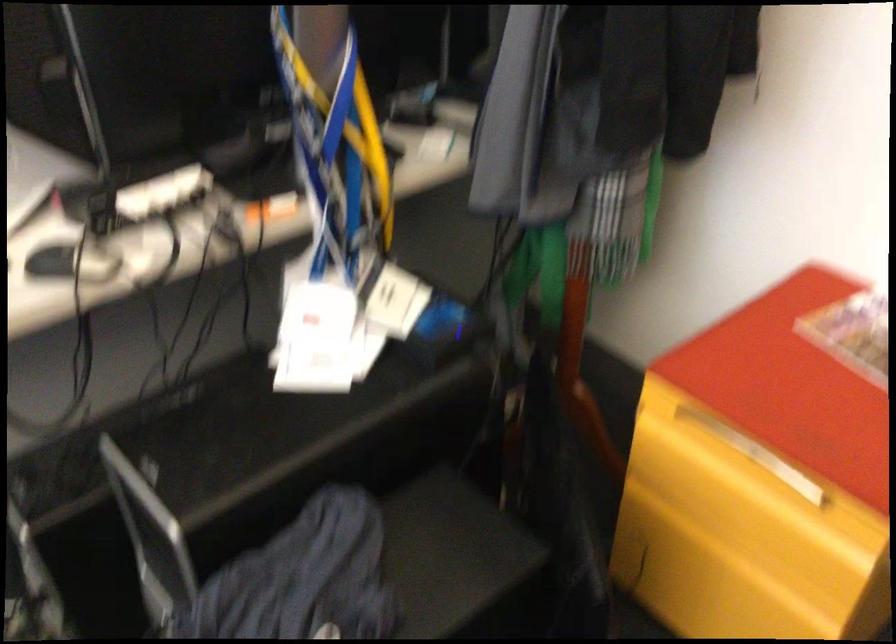
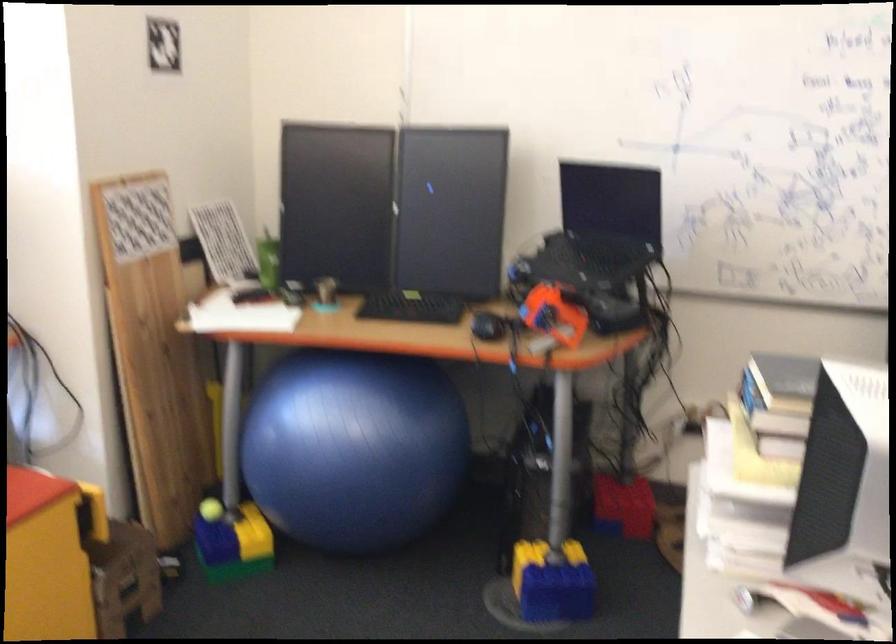
Question: The camera is either moving clockwise (left) or counter-clockwise (right) around the object. The first image is from the beginning of the video and the second image is from the end. Is the camera moving left or right when shooting the video?

Choices:
 (A) Left
 (B) Right

Answer: (B)